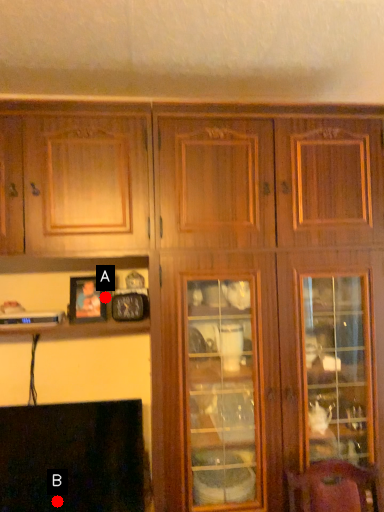
Question: Two points are circled on the image, labeled by A and B beside each circle. Which of the following is the farthest from the observer?

Choices:
 (A) A is further
 (B) B is further

Answer: (A)